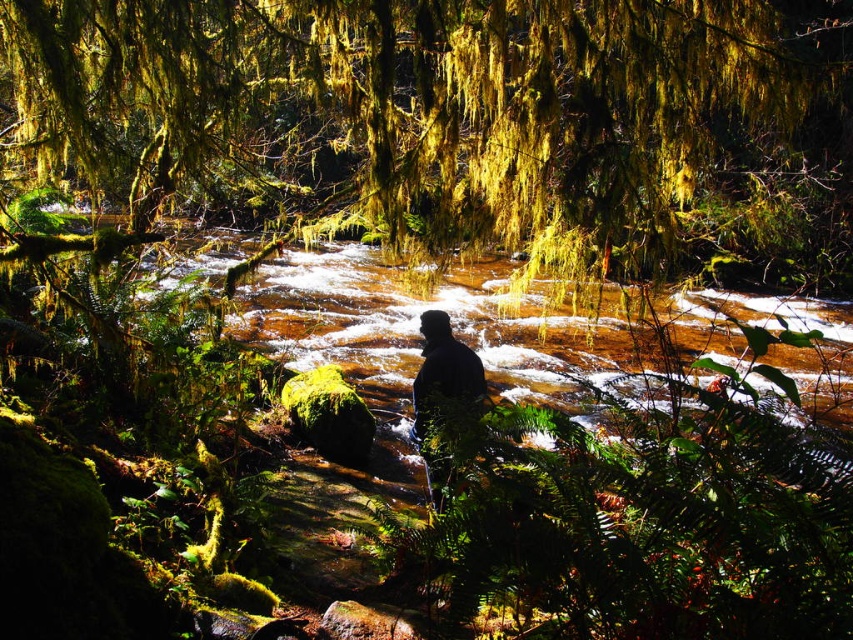
You are a hiker who wants to take a photo of the green mossy tree at center and the black matte person at center. From your current position, which object is higher in the frame?

The green mossy tree at center is above the black matte person at center, so it is higher in the frame.

You are planning to take a photo of the black matte person at center and the green mossy tree at center from a distance. Which object will appear larger in the photo?

The green mossy tree at center will appear larger in the photo because it is much taller than the black matte person at center.